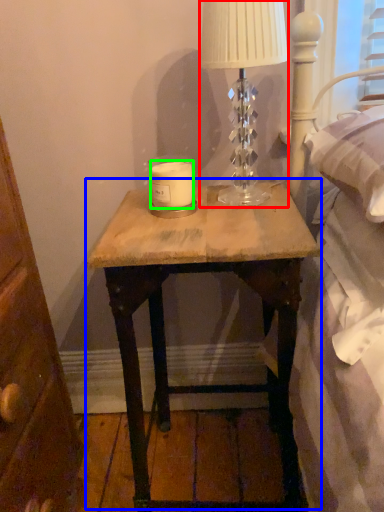
Question: Considering the real-world distances, which object is closest to table lamp (highlighted by a red box)? nightstand (highlighted by a blue box) or candle (highlighted by a green box).

Choices:
 (A) nightstand
 (B) candle

Answer: (B)